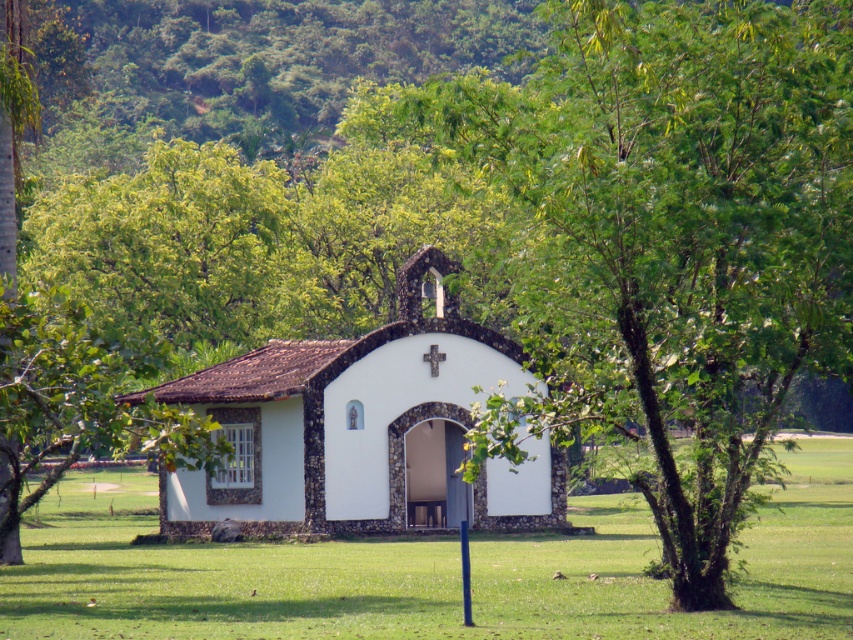
Who is positioned more to the right, green leafy tree at center or white stucco church at center?

Positioned to the right is green leafy tree at center.

Does green leafy tree at center have a lesser height compared to white stucco church at center?

No.

Is point (759, 260) farther from camera compared to point (247, 444)?

No, it is not.

Image resolution: width=853 pixels, height=640 pixels. In order to click on green leafy tree at center in this screenshot , I will do `click(670, 240)`.

Is green leafy tree at center taller than green grass at center?

Yes, green leafy tree at center is taller than green grass at center.

Can you confirm if green leafy tree at center is smaller than green grass at center?

Actually, green leafy tree at center might be larger than green grass at center.

I want to click on green leafy tree at center, so pos(670,240).

Does green grass at center appear on the right side of white stucco church at center?

Correct, you'll find green grass at center to the right of white stucco church at center.

I want to click on green grass at center, so click(x=426, y=572).

The image size is (853, 640). What are the coordinates of `green grass at center` in the screenshot? It's located at (426, 572).